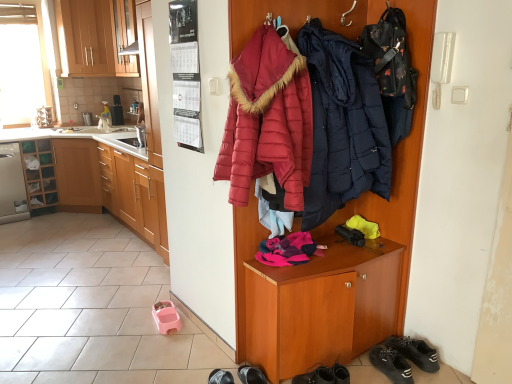
What are the coordinates of `vacant space to the left of wooden cabinet at left, which ranks as the first cabinetry in right-to-left order` in the screenshot? It's located at (69, 237).